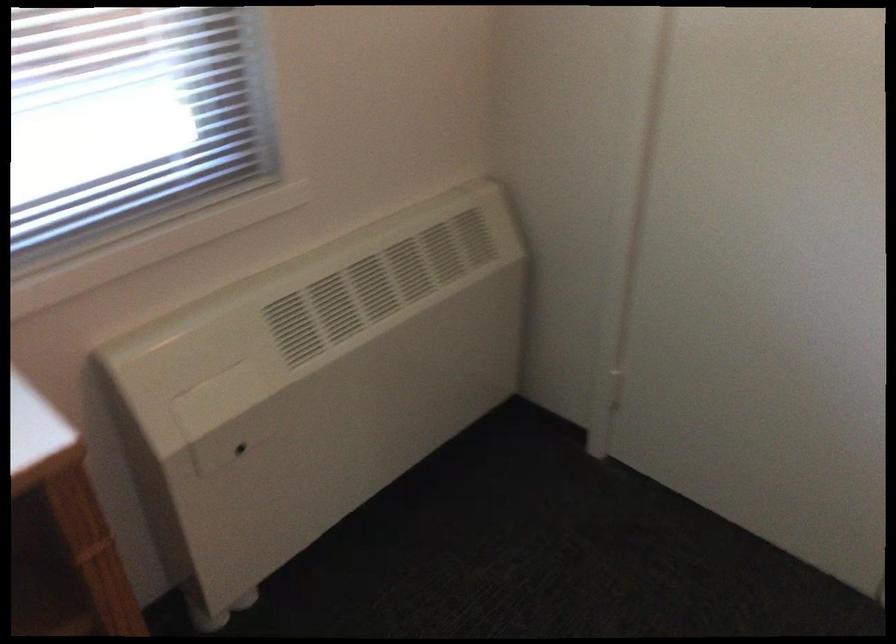
The image size is (896, 644). Describe the element at coordinates (216, 398) in the screenshot. I see `the heater panel latch` at that location.